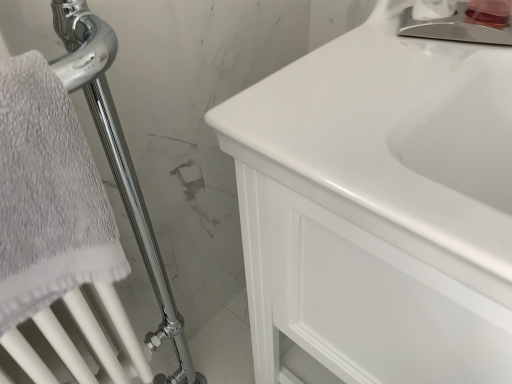
Locate an element on the screen. The height and width of the screenshot is (384, 512). vacant area situated to the left side of polished chrome faucet at upper right is located at coordinates (374, 62).